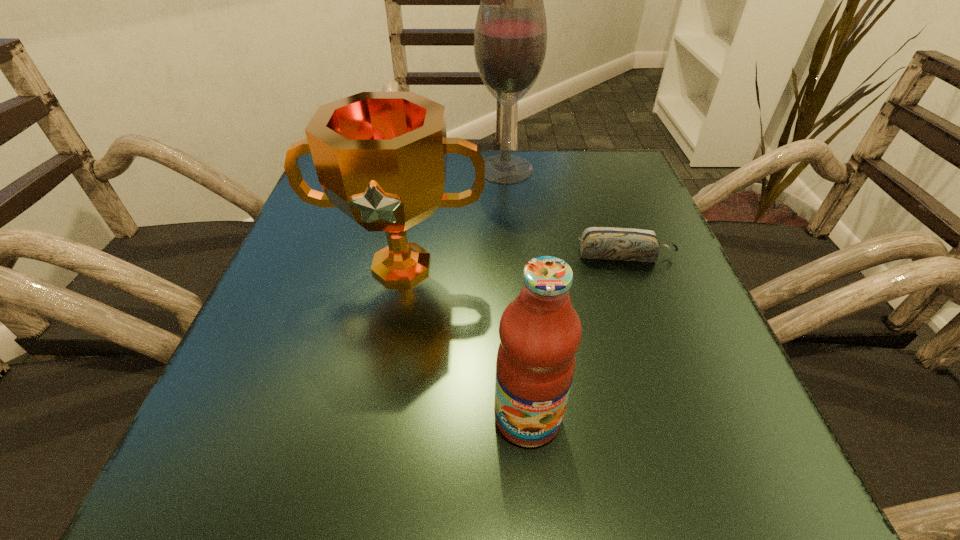
Find the location of `alcohol`. alcohol is located at coordinates (510, 38).

Locate an element on the screen. the tallest object is located at coordinates (510, 38).

The width and height of the screenshot is (960, 540). Find the location of `award`. award is located at coordinates (381, 157).

This screenshot has width=960, height=540. In order to click on the nearest object in this screenshot , I will do `click(540, 332)`.

This screenshot has width=960, height=540. Identify the location of the shortest object. (626, 244).

The height and width of the screenshot is (540, 960). What are the coordinates of `the rightmost object` in the screenshot? It's located at (626, 244).

This screenshot has width=960, height=540. What are the coordinates of `free space located on the left of the alcohol` in the screenshot? It's located at (369, 169).

The height and width of the screenshot is (540, 960). Find the location of `free region located 0.170m on the side of the award with the star emblem`. free region located 0.170m on the side of the award with the star emblem is located at coordinates (376, 397).

In order to click on vacant space located on the front label of the nearest object in this screenshot , I will do `click(535, 501)`.

The height and width of the screenshot is (540, 960). In order to click on vacant area situated 0.320m on the left of the rightmost object in this screenshot , I will do `click(404, 254)`.